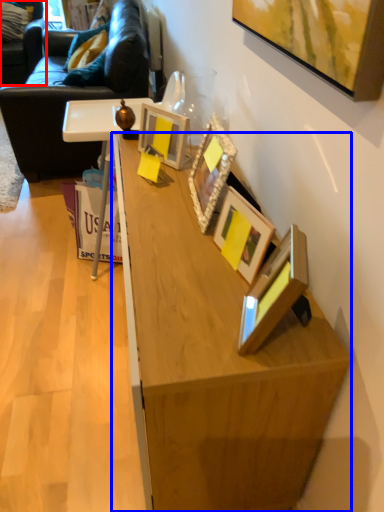
Question: Which point is closer to the camera, swivel chair (highlighted by a red box) or desk (highlighted by a blue box)?

Choices:
 (A) swivel chair
 (B) desk

Answer: (B)